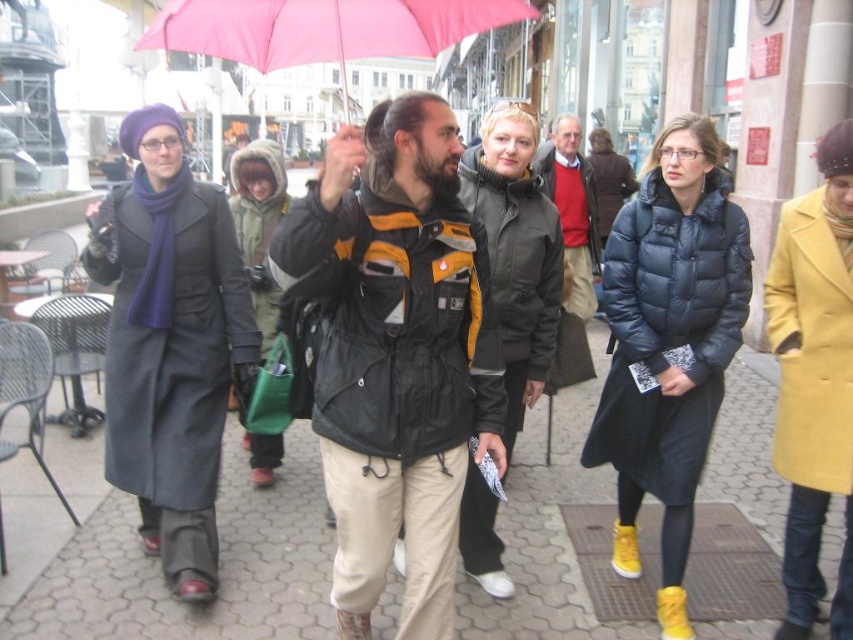
You are standing on the sidewalk and see the yellow wool coat at right and the pink fabric umbrella at upper center. Which object is nearer to you?

The yellow wool coat at right is closer to the viewer than the pink fabric umbrella at upper center.

You are a street vendor trying to set up a booth between the yellow wool coat at right and the pink fabric umbrella at upper center. The booth requires 1.2 meters of space. Can you fit it there based on their widths?

The yellow wool coat at right is narrower than the pink fabric umbrella at upper center, but since the exact widths aren

You are standing at the origin point of the coordinate system in this street scene. The origin is at the bottom left corner of the image. The coordinate system has a maximum x value of 1.0 on the right edge and a maximum y value of 1.0 at the top edge. You want to locate the matte black jacket at center. What are its coordinates?

The coordinates of the matte black jacket at center are at point (515, 250).